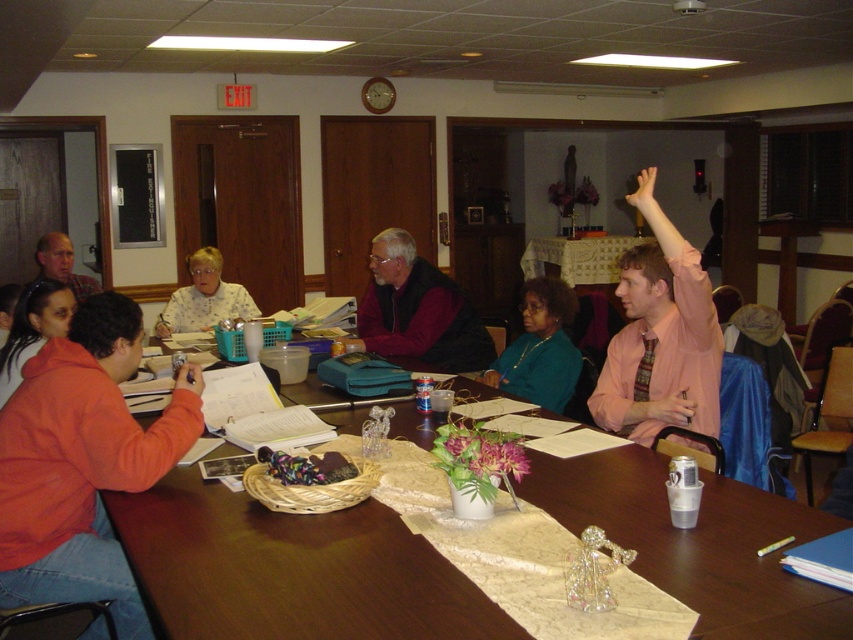
Is teal fabric jacket at center closer to camera compared to white lace tablecloth at center?

Yes.

Between teal fabric jacket at center and white lace tablecloth at center, which one appears on the left side from the viewer's perspective?

teal fabric jacket at center is more to the left.

Where is `teal fabric jacket at center`? teal fabric jacket at center is located at coordinates [540, 348].

The height and width of the screenshot is (640, 853). I want to click on teal fabric jacket at center, so click(x=540, y=348).

Can you confirm if matte black hair at upper left is wider than pink flesh at upper right?

No.

Describe the element at coordinates (62, 264) in the screenshot. I see `matte black hair at upper left` at that location.

Identify the location of matte black hair at upper left. (62, 264).

Which is below, maroon sweater at center or light blue floral blouse at center?

maroon sweater at center is below.

Does maroon sweater at center have a greater height compared to light blue floral blouse at center?

Yes, maroon sweater at center is taller than light blue floral blouse at center.

Is point (376, 260) positioned behind point (183, 326)?

No, (376, 260) is in front of (183, 326).

The width and height of the screenshot is (853, 640). I want to click on maroon sweater at center, so click(x=418, y=310).